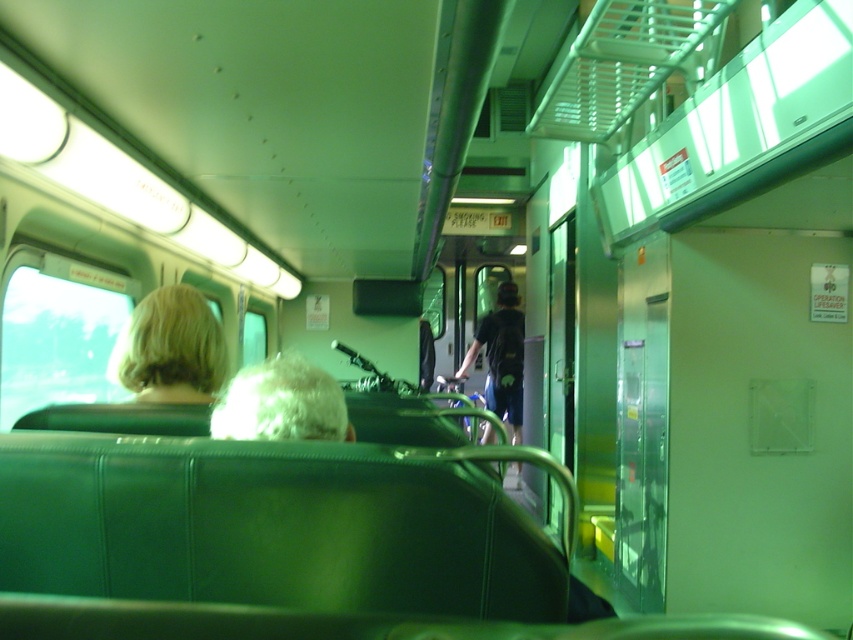
Question: Among these points, which one is farthest from the camera?

Choices:
 (A) (204, 308)
 (B) (252, 396)

Answer: (A)

Question: Among these objects, which one is nearest to the camera?

Choices:
 (A) blonde hair at left
 (B) white curly hair at upper center

Answer: (B)

Question: Is blonde hair at left smaller than white curly hair at upper center?

Choices:
 (A) yes
 (B) no

Answer: (A)

Question: Does blonde hair at left appear under white curly hair at upper center?

Choices:
 (A) yes
 (B) no

Answer: (B)

Question: Does blonde hair at left have a greater width compared to white curly hair at upper center?

Choices:
 (A) yes
 (B) no

Answer: (B)